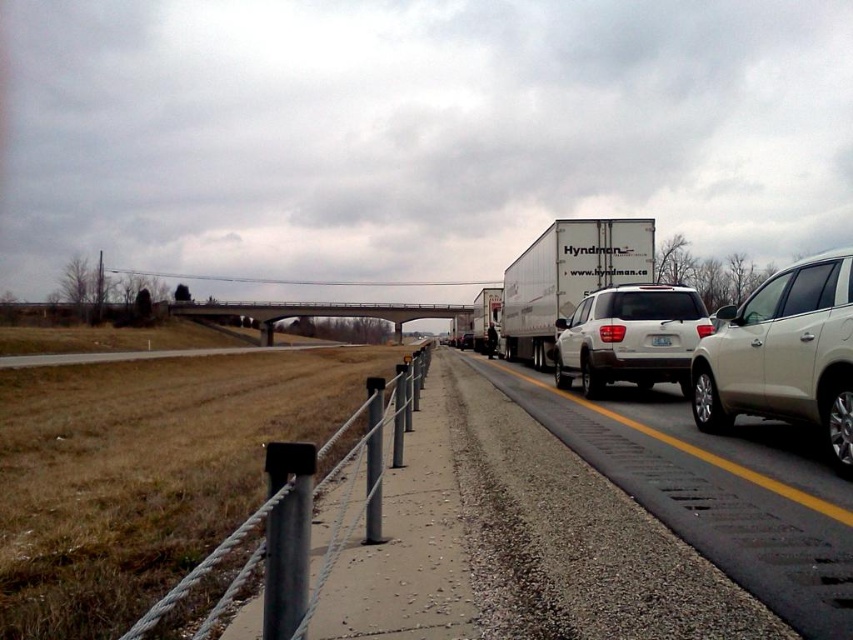
In the scene shown: Does white matte suv at center have a larger size compared to white plastic license plate at center?

Indeed, white matte suv at center has a larger size compared to white plastic license plate at center.

Can you confirm if white matte suv at center is wider than white plastic license plate at center?

Indeed, white matte suv at center has a greater width compared to white plastic license plate at center.

Does point (628, 307) lie in front of point (659, 340)?

No, it is behind (659, 340).

The width and height of the screenshot is (853, 640). I want to click on white matte suv at center, so click(630, 337).

Identify the location of black asphalt road at center. This screenshot has height=640, width=853. point(714,492).

Is black asphalt road at center to the left of white matte suv at right from the viewer's perspective?

Indeed, black asphalt road at center is positioned on the left side of white matte suv at right.

Is point (839, 532) closer to viewer compared to point (843, 372)?

Yes, it is in front of point (843, 372).

This screenshot has width=853, height=640. I want to click on black asphalt road at center, so click(714, 492).

Describe the element at coordinates (714, 492) in the screenshot. I see `black asphalt road at center` at that location.

This screenshot has height=640, width=853. What are the coordinates of `black asphalt road at center` in the screenshot? It's located at (714, 492).

Identify the location of black asphalt road at center. The image size is (853, 640). coord(714,492).